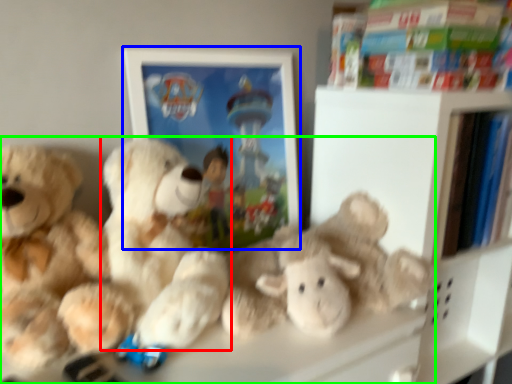
Question: Estimate the real-world distances between objects in this image. Which object is closer to teddy bear (highlighted by a red box), picture frame (highlighted by a blue box) or teddy bear (highlighted by a green box)?

Choices:
 (A) picture frame
 (B) teddy bear

Answer: (B)